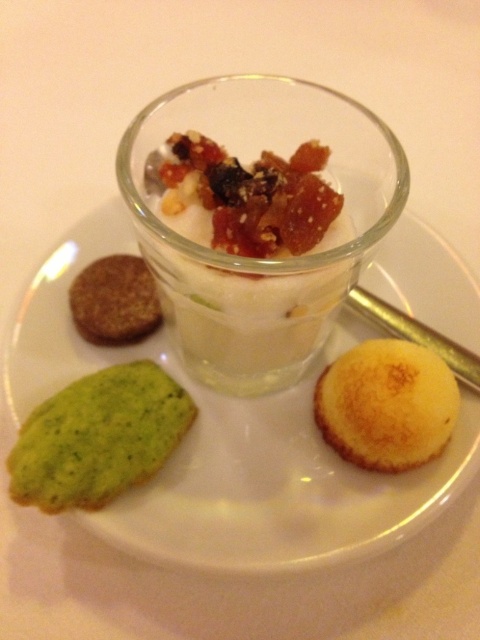
Question: Which point appears farthest from the camera in this image?

Choices:
 (A) (84, 300)
 (B) (87, 486)

Answer: (A)

Question: Among these points, which one is farthest from the camera?

Choices:
 (A) (436, 241)
 (B) (80, 493)
 (C) (433, 428)
 (D) (143, 296)

Answer: (A)

Question: Which of the following is the farthest from the observer?

Choices:
 (A) (144, 276)
 (B) (286, 465)
 (C) (351, 440)
 (D) (112, 438)

Answer: (A)

Question: Does green textured cookie at lower left have a greater width compared to brown crumbly cookie at left?

Choices:
 (A) no
 (B) yes

Answer: (B)

Question: Can you confirm if green textured cookie at lower left is wider than brown crumbly cookie at left?

Choices:
 (A) no
 (B) yes

Answer: (B)

Question: Is green textured cookie at lower left closer to camera compared to brown crumbly cookie at left?

Choices:
 (A) no
 (B) yes

Answer: (B)